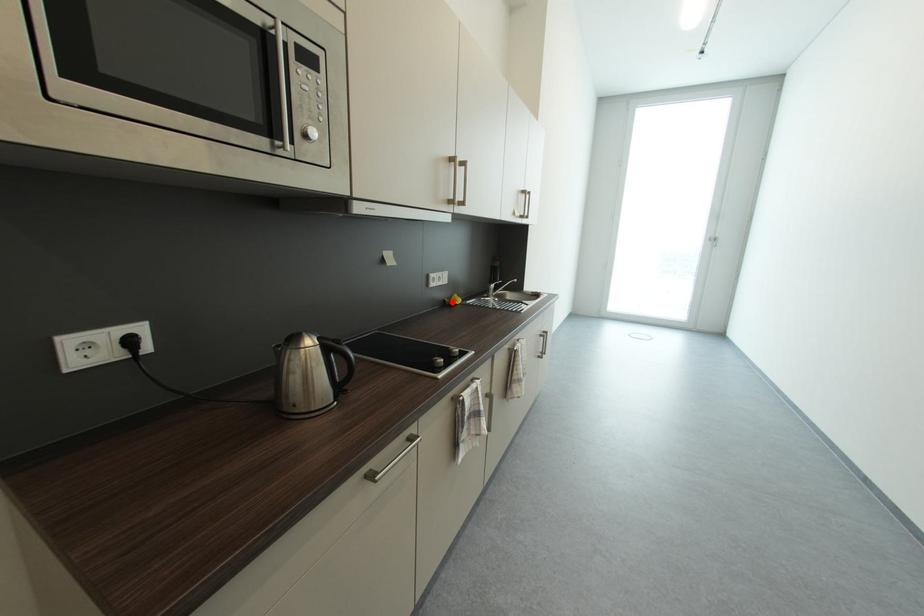
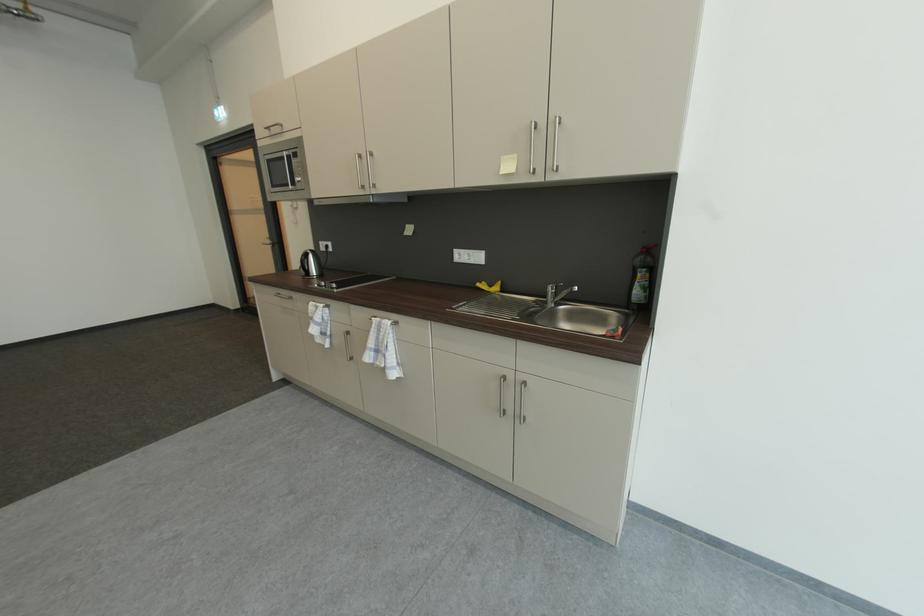
Find the pixel in the second image that matches the highlighted location in the first image.

(487, 284)